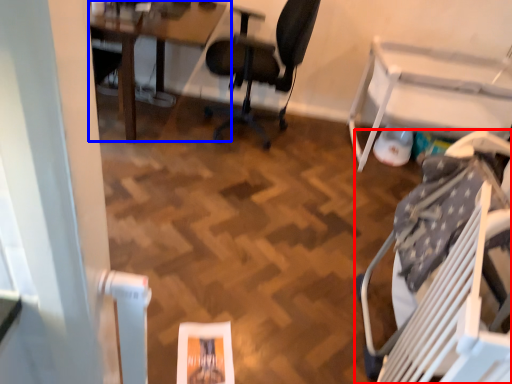
Question: Which object appears farthest to the camera in this image, chair (highlighted by a red box) or table (highlighted by a blue box)?

Choices:
 (A) chair
 (B) table

Answer: (B)